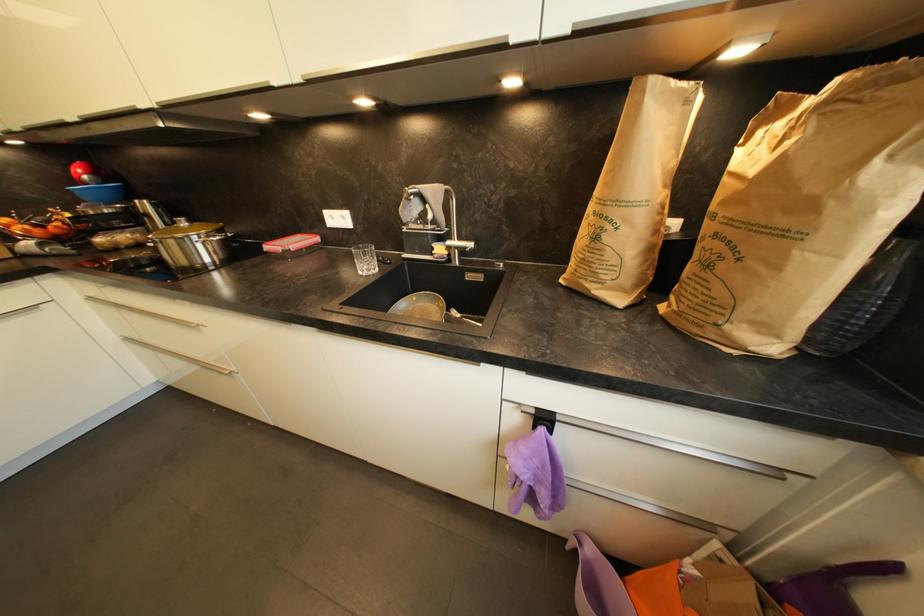
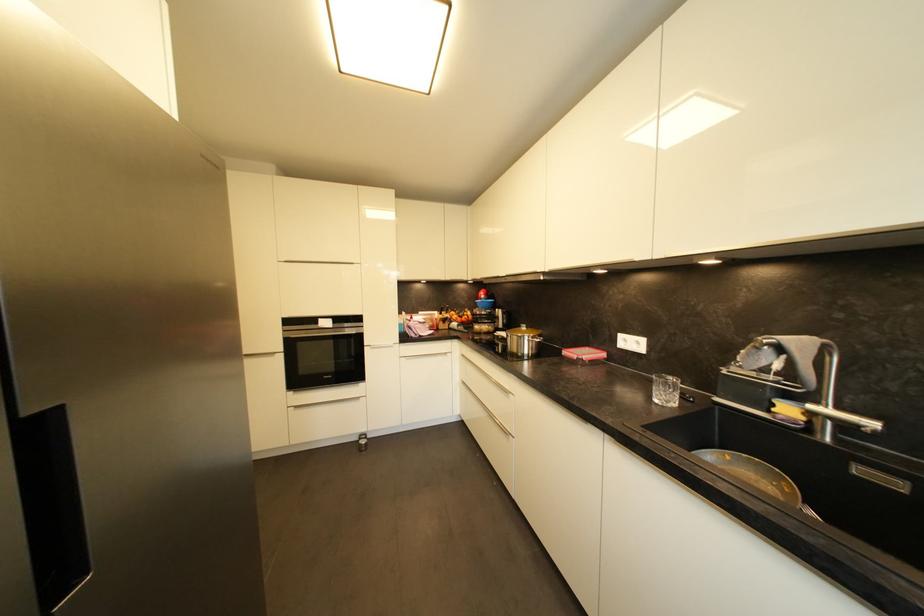
Locate, in the second image, the point that corresponds to (365,275) in the first image.

(661, 403)